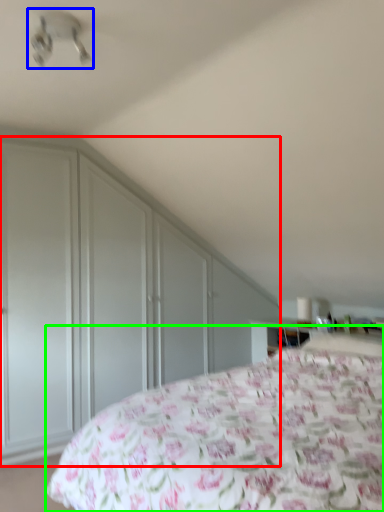
Question: Based on their relative distances, which object is nearer to dresser (highlighted by a red box)? Choose from fan (highlighted by a blue box) and bed (highlighted by a green box).

Choices:
 (A) fan
 (B) bed

Answer: (B)